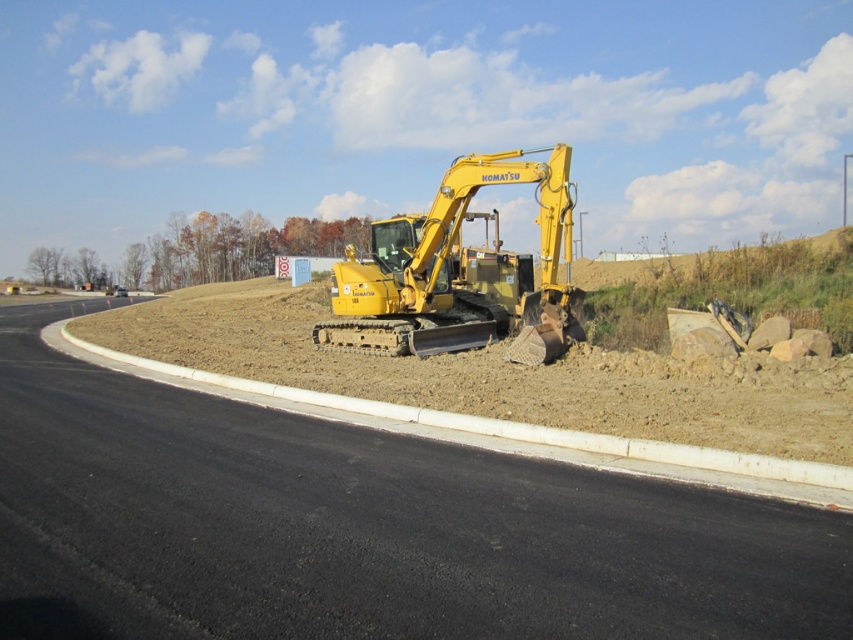
Which is in front, point (55, 456) or point (519, 353)?

Positioned in front is point (55, 456).

Does black asphalt highway at center have a larger size compared to yellow metallic excavator at center?

Actually, black asphalt highway at center might be smaller than yellow metallic excavator at center.

At what (x,y) coordinates should I click in order to perform the action: click on black asphalt highway at center. Please return your answer as a coordinate pair (x, y). Looking at the image, I should click on (361, 528).